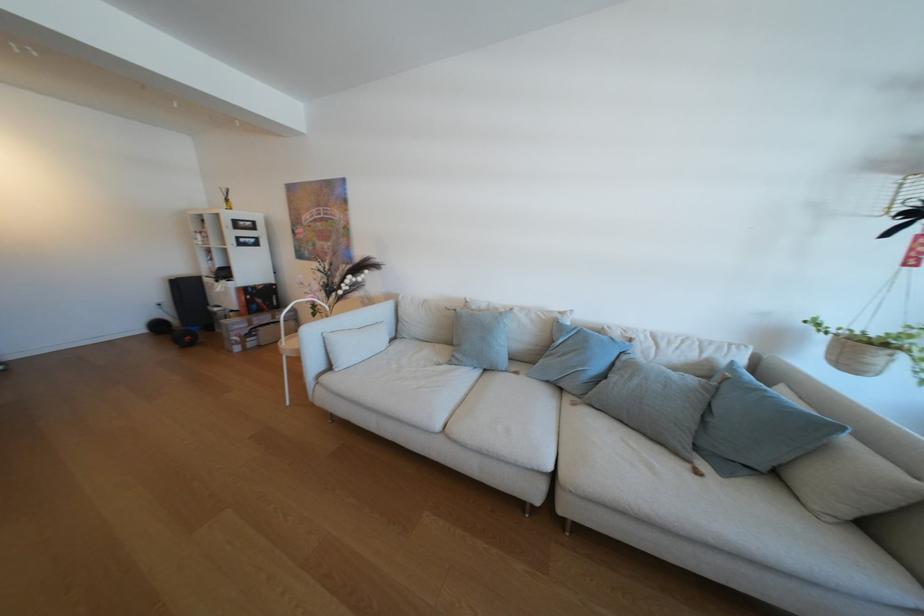
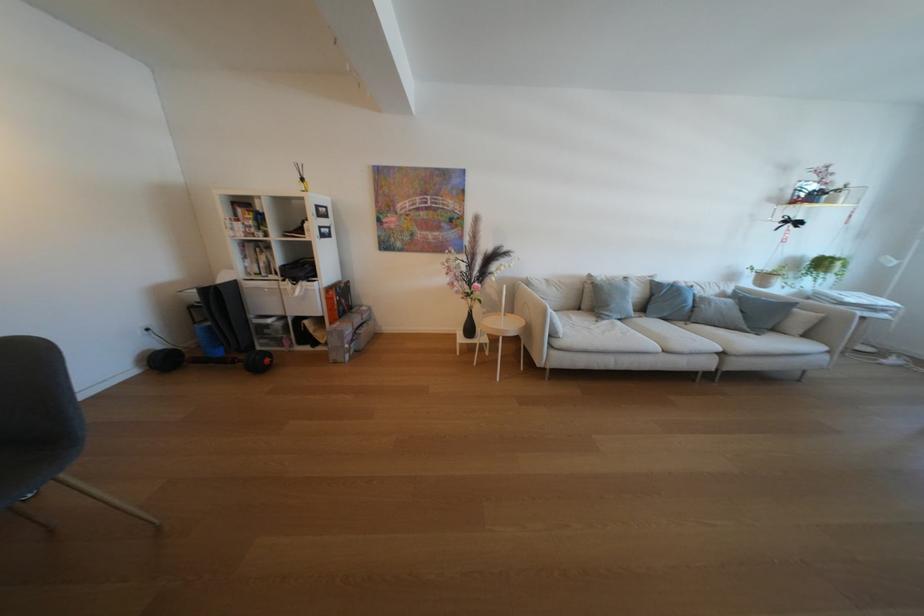
Find the pixel in the second image that matches (324,275) in the first image.

(455, 265)